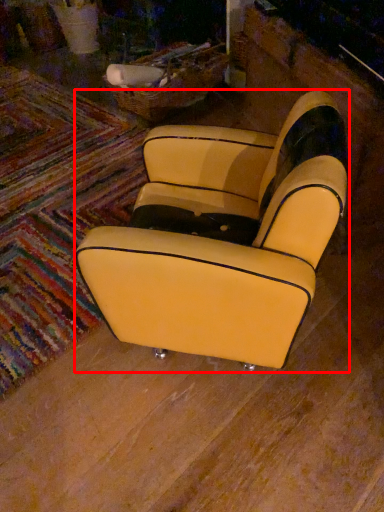
Question: From the image, what is the correct spatial relationship of chair (annotated by the red box) in relation to mat?

Choices:
 (A) left
 (B) right

Answer: (B)